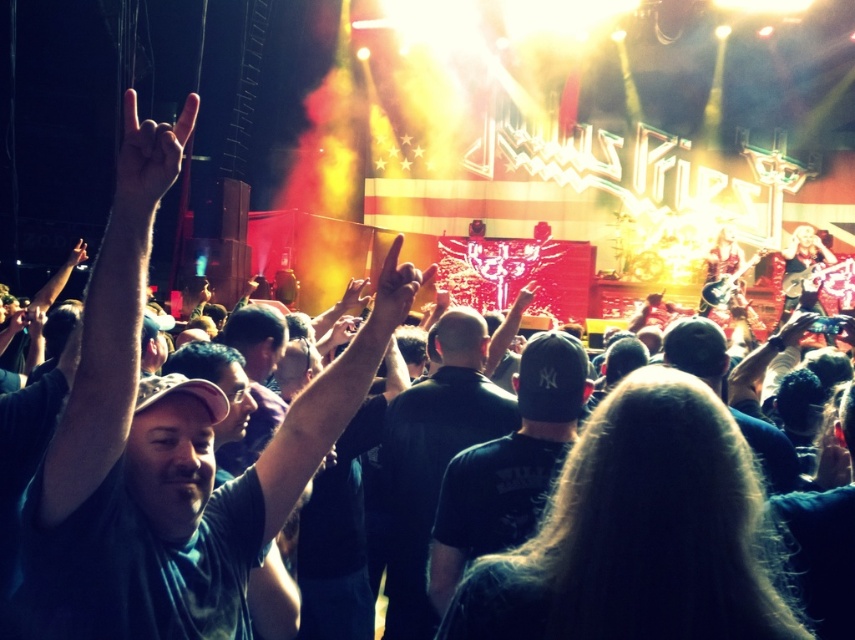
Can you confirm if dark green t-shirt at left is positioned below matte black hand at upper left?

Yes.

Who is lower down, dark green t-shirt at left or matte black hand at upper left?

dark green t-shirt at left is lower down.

Image resolution: width=855 pixels, height=640 pixels. Identify the location of dark green t-shirt at left. (168, 474).